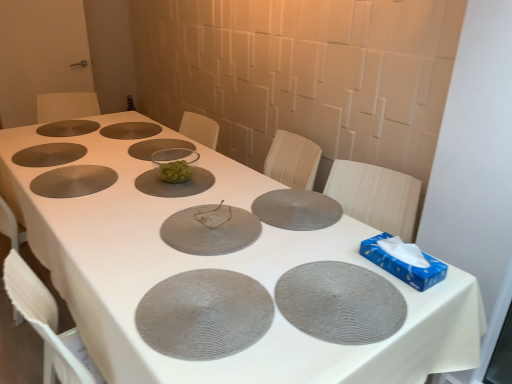
The width and height of the screenshot is (512, 384). Identify the location of vacant space underneath matte brown glass plate at center, which appears as the ninth glass plate when viewed from the front (from a real-world perspective). (124, 124).